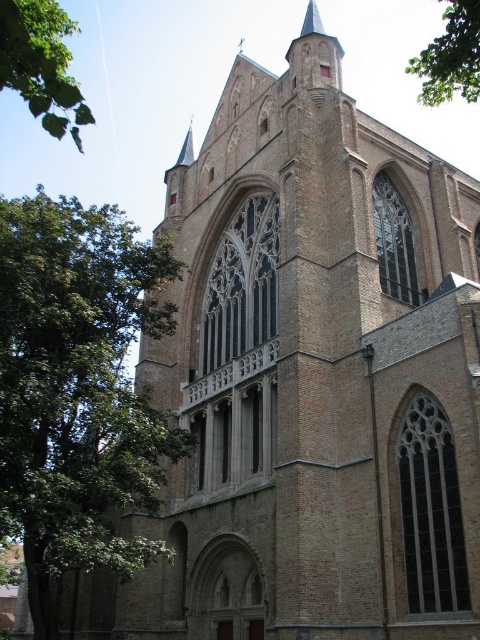
Question: Is green leafy tree at left above green leafy branch at upper left?

Choices:
 (A) no
 (B) yes

Answer: (A)

Question: Which object is closer to the camera taking this photo?

Choices:
 (A) green leafy tree at upper right
 (B) green leafy branch at upper left
 (C) green leafy tree at left

Answer: (B)

Question: Estimate the real-world distances between objects in this image. Which object is closer to the green leafy branch at upper left?

Choices:
 (A) green leafy tree at upper right
 (B) green leafy tree at left

Answer: (B)

Question: Based on their relative distances, which object is nearer to the green leafy tree at left?

Choices:
 (A) green leafy tree at upper right
 (B) green leafy branch at upper left

Answer: (B)

Question: Observing the image, what is the correct spatial positioning of green leafy tree at left in reference to green leafy branch at upper left?

Choices:
 (A) left
 (B) right

Answer: (A)

Question: Does green leafy branch at upper left have a lesser width compared to green leafy tree at upper right?

Choices:
 (A) no
 (B) yes

Answer: (B)